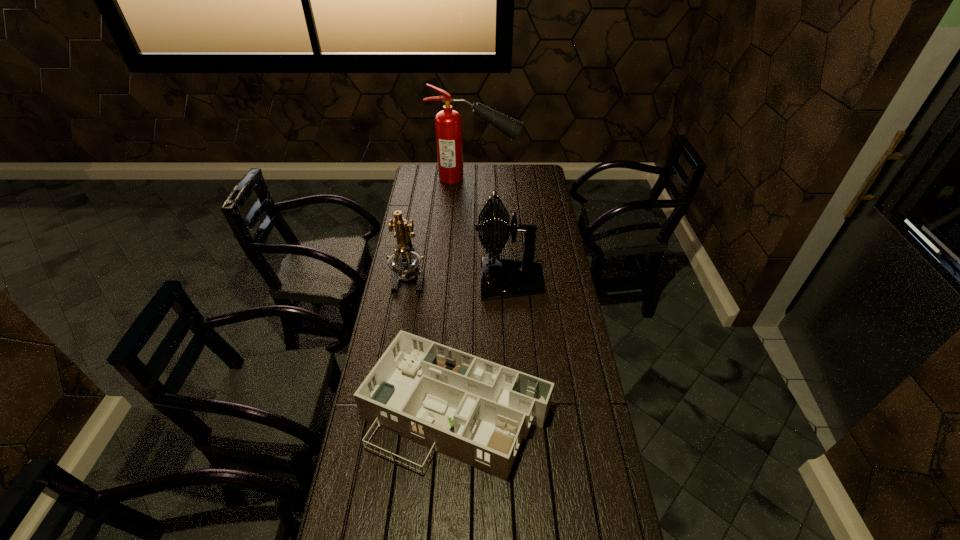
Locate an element on the screen. The height and width of the screenshot is (540, 960). fire extinguisher is located at coordinates (448, 123).

The width and height of the screenshot is (960, 540). In order to click on the tallest object in this screenshot , I will do `click(448, 123)`.

At what (x,y) coordinates should I click in order to perform the action: click on fan. Please return your answer as a coordinate pair (x, y). This screenshot has width=960, height=540. Looking at the image, I should click on (500, 278).

You are a GUI agent. You are given a task and a screenshot of the screen. Output one action in this format:
    pyautogui.click(x=<x>, y=<y>)
    Task: Click on the microscope
    This screenshot has width=960, height=540.
    Given the screenshot: What is the action you would take?
    pyautogui.click(x=404, y=262)

Find the location of a particular element. The image size is (960, 540). dollhouse is located at coordinates (476, 411).

The image size is (960, 540). I want to click on the nearest object, so click(x=476, y=411).

You are a GUI agent. You are given a task and a screenshot of the screen. Output one action in this format:
    pyautogui.click(x=<x>, y=<y>)
    Task: Click on the blank space located at the nozzle of the farthest object
    The height and width of the screenshot is (540, 960).
    Given the screenshot: What is the action you would take?
    pyautogui.click(x=530, y=178)

Where is `vacant space located in front of the fan to blow air`? This screenshot has width=960, height=540. vacant space located in front of the fan to blow air is located at coordinates (444, 281).

Locate an element on the screen. free space located 0.180m in front of the fan to blow air is located at coordinates (434, 281).

You are a GUI agent. You are given a task and a screenshot of the screen. Output one action in this format:
    pyautogui.click(x=<x>, y=<y>)
    Task: Click on the vacant area situated 0.190m in front of the fan to blow air
    The width and height of the screenshot is (960, 540).
    Given the screenshot: What is the action you would take?
    pyautogui.click(x=432, y=281)